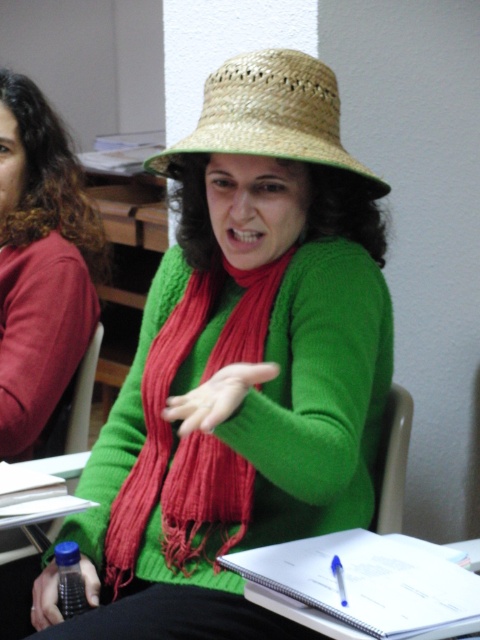
Consider the image. Who is lower down, matte green sweater at center or matte plastic chair at lower right?

matte plastic chair at lower right is lower down.

Identify the location of matte green sweater at center. Image resolution: width=480 pixels, height=640 pixels. (40, 264).

Based on the photo, who is positioned more to the right, natural straw hat at center or smooth green hand at center?

natural straw hat at center is more to the right.

This screenshot has height=640, width=480. What do you see at coordinates (269, 115) in the screenshot?
I see `natural straw hat at center` at bounding box center [269, 115].

You are a GUI agent. You are given a task and a screenshot of the screen. Output one action in this format:
    pyautogui.click(x=<x>, y=<y>)
    Task: Click on the natural straw hat at center
    This screenshot has height=640, width=480.
    Given the screenshot: What is the action you would take?
    pyautogui.click(x=269, y=115)

Does matte straw hat at center have a greater width compared to matte green sweater at center?

Yes, matte straw hat at center is wider than matte green sweater at center.

Does matte straw hat at center appear on the left side of matte green sweater at center?

Incorrect, matte straw hat at center is not on the left side of matte green sweater at center.

The height and width of the screenshot is (640, 480). What do you see at coordinates (243, 360) in the screenshot? I see `matte straw hat at center` at bounding box center [243, 360].

Find the location of a particular element. The width and height of the screenshot is (480, 640). matte straw hat at center is located at coordinates (243, 360).